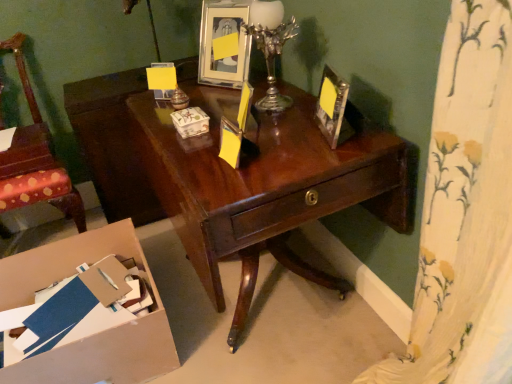
Image resolution: width=512 pixels, height=384 pixels. I want to click on vacant space to the left of matte ceramic box at center, so point(159,130).